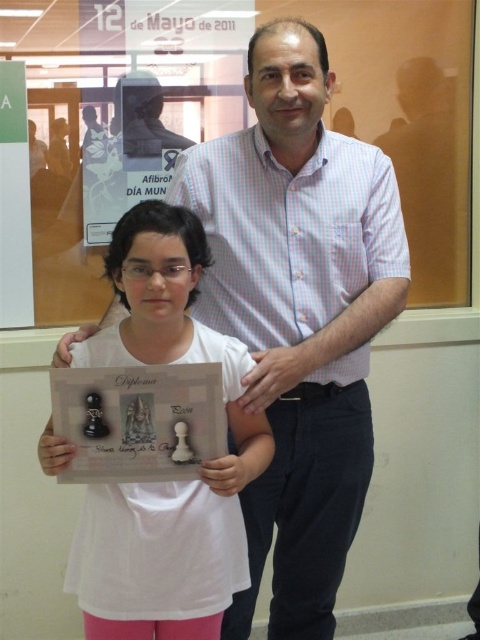
Is white paper diploma at center to the right of matte paper plaque at center from the viewer's perspective?

Indeed, white paper diploma at center is positioned on the right side of matte paper plaque at center.

Does point (179, 630) come farther from viewer compared to point (211, 394)?

Yes, point (179, 630) is farther from viewer.

What are the coordinates of `white paper diploma at center` in the screenshot? It's located at (168, 481).

Which is more to the right, light blue checkered shirt at center or white paper diploma at center?

Positioned to the right is light blue checkered shirt at center.

From the picture: Can you confirm if light blue checkered shirt at center is positioned to the right of white paper diploma at center?

Correct, you'll find light blue checkered shirt at center to the right of white paper diploma at center.

Locate an element on the screen. This screenshot has width=480, height=640. light blue checkered shirt at center is located at coordinates (299, 314).

Find the location of a particular element. light blue checkered shirt at center is located at coordinates (299, 314).

Can you confirm if light blue checkered shirt at center is positioned to the left of matte paper plaque at center?

No, light blue checkered shirt at center is not to the left of matte paper plaque at center.

What do you see at coordinates (299, 314) in the screenshot?
I see `light blue checkered shirt at center` at bounding box center [299, 314].

Which is behind, point (299, 275) or point (73, 385)?

Positioned behind is point (299, 275).

The width and height of the screenshot is (480, 640). In order to click on light blue checkered shirt at center in this screenshot , I will do `click(299, 314)`.